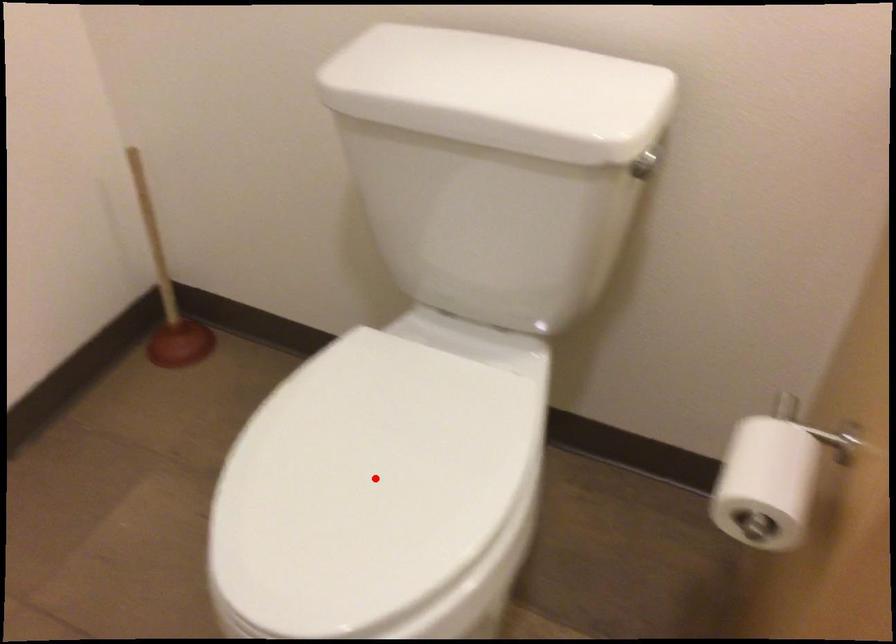
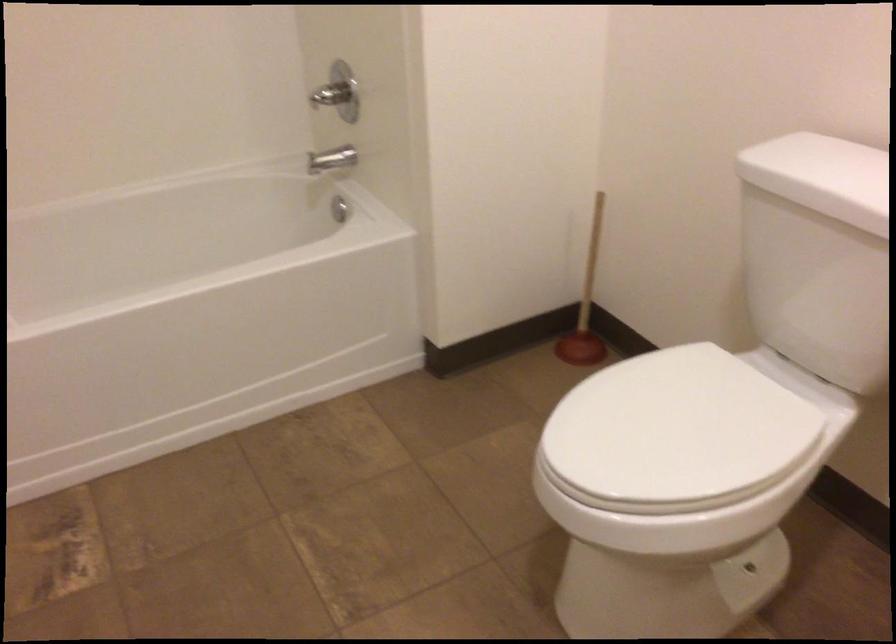
Locate, in the second image, the point that corresponds to the highlighted location in the first image.

(675, 431)